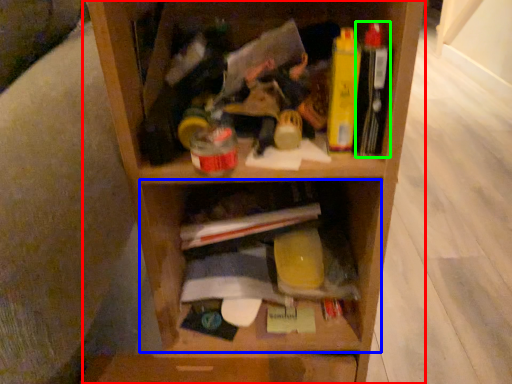
Question: Which is farther away from shelf (highlighted by a red box)? cabinet (highlighted by a blue box) or book (highlighted by a green box)?

Choices:
 (A) cabinet
 (B) book

Answer: (B)